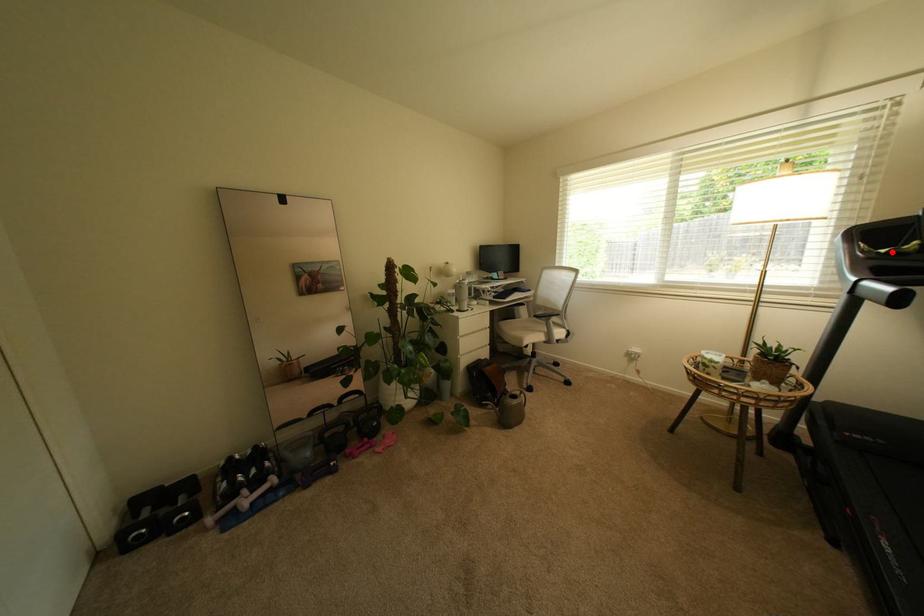
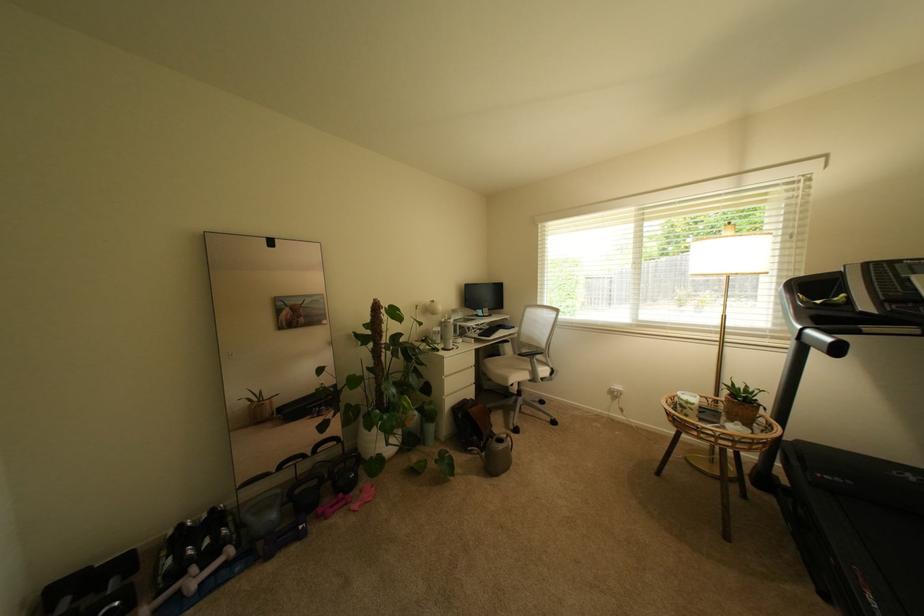
In the second image, find the point that corresponds to the highlighted location in the first image.

(827, 302)